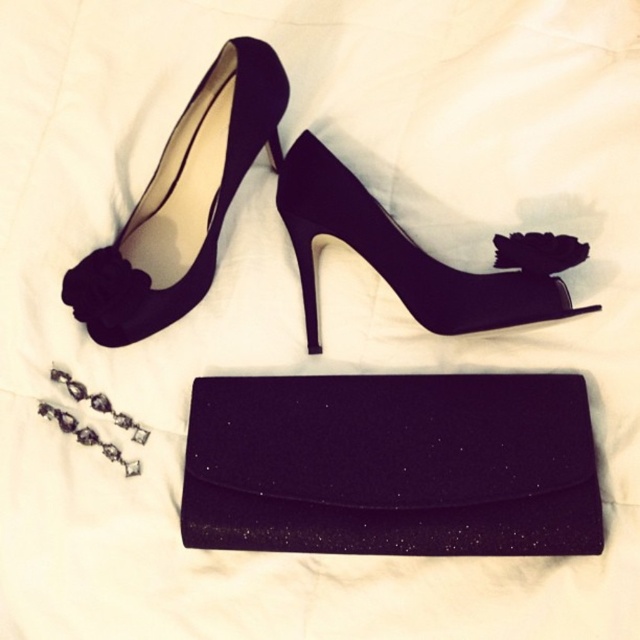
Is sparkly purple clutch at center positioned at the back of satin black high-heeled shoe at center?

That is False.

Does point (346, 518) come farther from viewer compared to point (340, 166)?

No, (346, 518) is closer to viewer.

This screenshot has height=640, width=640. What are the coordinates of `sparkly purple clutch at center` in the screenshot? It's located at (392, 465).

The width and height of the screenshot is (640, 640). Identify the location of sparkly purple clutch at center. (392, 465).

Which is above, sparkly purple clutch at center or satin black high-heeled shoe at upper left?

satin black high-heeled shoe at upper left is higher up.

Looking at this image, does sparkly purple clutch at center come behind satin black high-heeled shoe at upper left?

That is False.

Where is `sparkly purple clutch at center`? sparkly purple clutch at center is located at coordinates (392, 465).

Can you confirm if satin black high-heeled shoe at upper left is shorter than satin black high-heeled shoe at center?

In fact, satin black high-heeled shoe at upper left may be taller than satin black high-heeled shoe at center.

Which is in front, point (150, 321) or point (477, 307)?

Point (477, 307) is in front.

Find the location of a particular element. satin black high-heeled shoe at upper left is located at coordinates (182, 202).

You are a GUI agent. You are given a task and a screenshot of the screen. Output one action in this format:
    pyautogui.click(x=<x>, y=<y>)
    Task: Click on the satin black high-heeled shoe at upper left
    
    Given the screenshot: What is the action you would take?
    pyautogui.click(x=182, y=202)